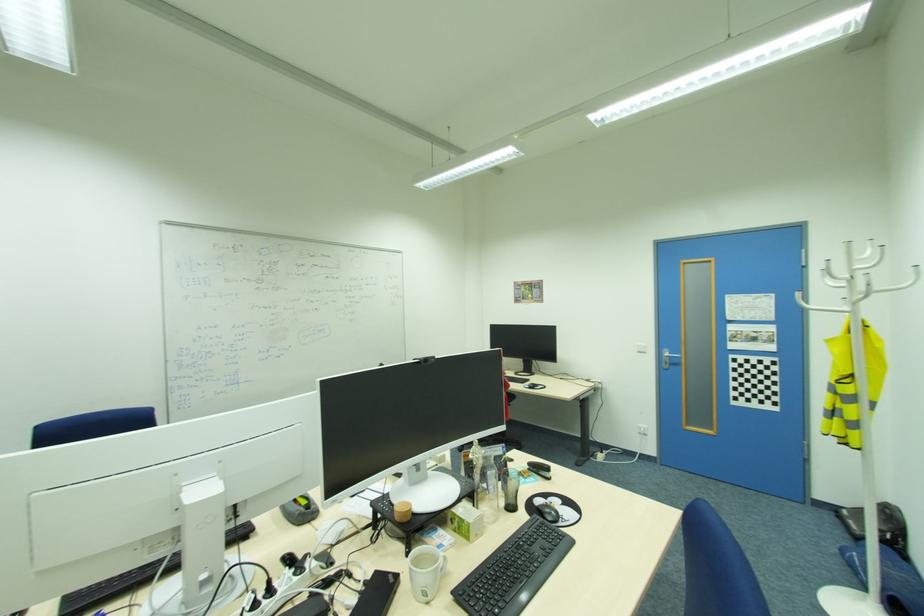
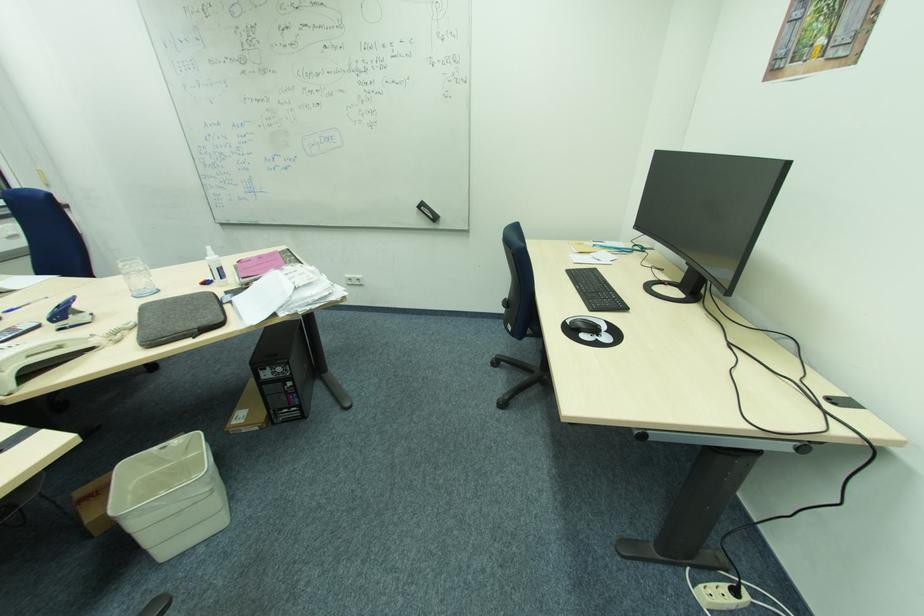
The point at (530,387) is marked in the first image. Where is the corresponding point in the second image?

(572, 323)